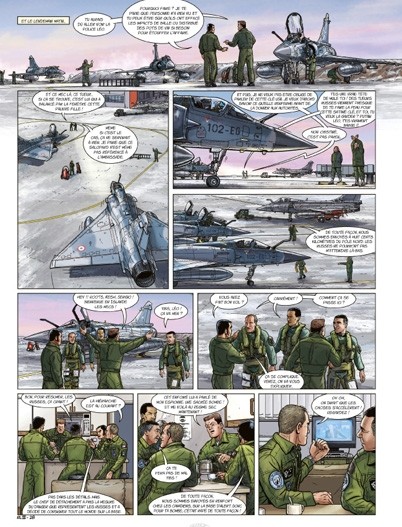
At what (x,y) coordinates should I click in order to perform the action: click on cup handle. Please return your answer as a coordinate pair (x, y). Looking at the image, I should click on (217, 475), (303, 506).